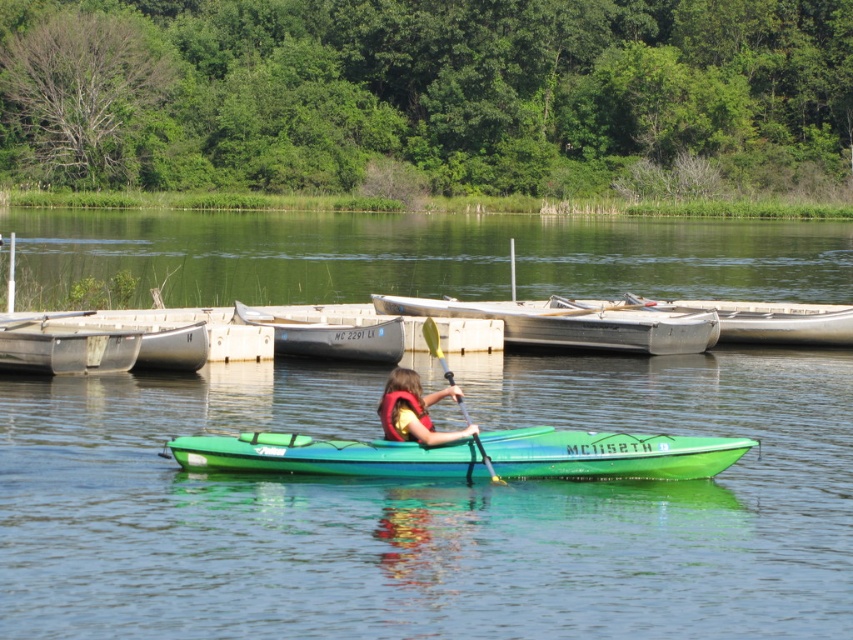
Question: Does green plastic kayak at center have a greater width compared to gray matte canoe at center?

Choices:
 (A) yes
 (B) no

Answer: (A)

Question: Among these objects, which one is farthest from the camera?

Choices:
 (A) silver metallic rowboat at center
 (B) white plastic canoe at center
 (C) smooth white paddle at left

Answer: (B)

Question: Which point is closer to the camera?

Choices:
 (A) green plastic kayak at center
 (B) transparent water at center
 (C) metallic gray canoe at left

Answer: (B)

Question: Which point appears farthest from the camera in this image?

Choices:
 (A) pos(83,316)
 (B) pos(677,291)
 (C) pos(316,353)

Answer: (B)

Question: Where is metallic gray canoe at left located in relation to white plastic canoe at center in the image?

Choices:
 (A) below
 (B) above

Answer: (A)

Question: Is metallic gray canoe at left to the right of smooth white paddle at left from the viewer's perspective?

Choices:
 (A) no
 (B) yes

Answer: (B)